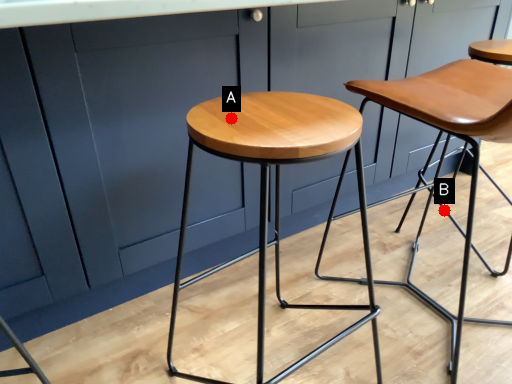
Question: Two points are circled on the image, labeled by A and B beside each circle. Which point appears farthest from the camera in this image?

Choices:
 (A) A is further
 (B) B is further

Answer: (B)